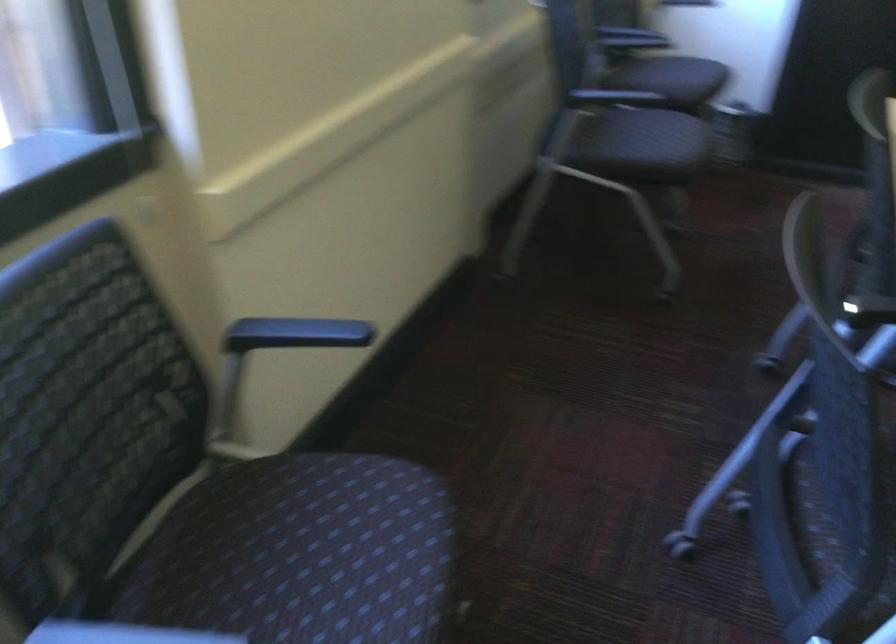
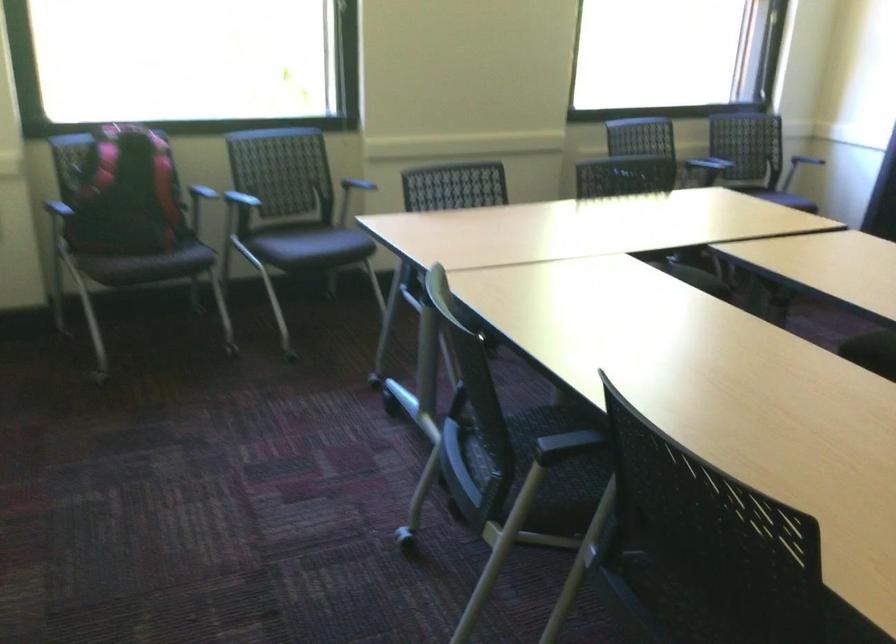
In the second image, find the point that corresponds to [245,299] in the first image.

(362, 176)